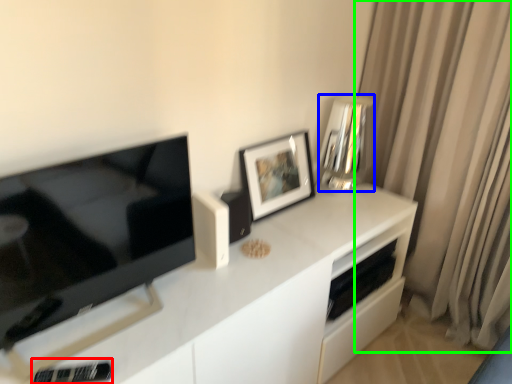
Question: Which is nearer to the appliance (highlighted by a red box)? appliance (highlighted by a blue box) or curtain (highlighted by a green box).

Choices:
 (A) appliance
 (B) curtain

Answer: (A)